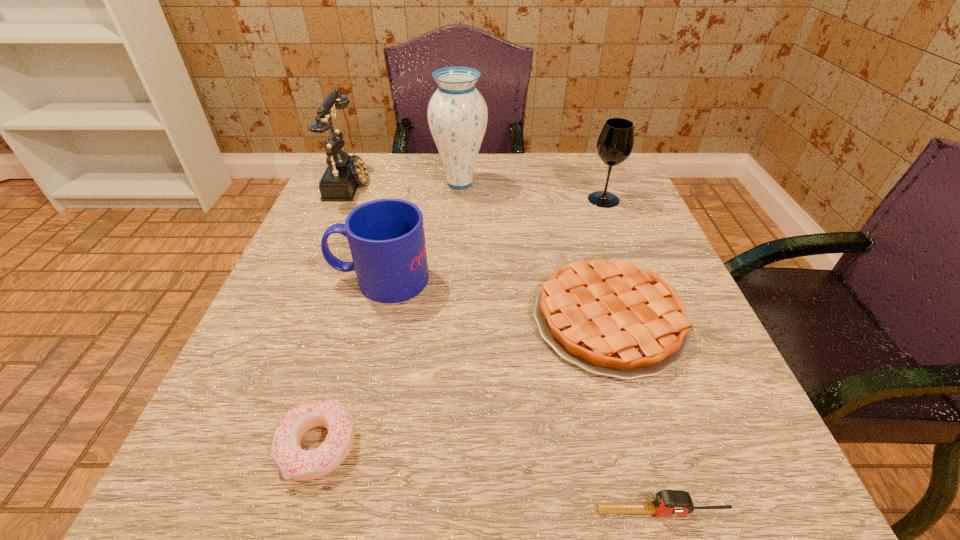
At what (x,y) coordinates should I click in order to perform the action: click on blank space located on the side with the handle of the mug. Please return your answer as a coordinate pair (x, y). Looking at the image, I should click on point(299,279).

Find the location of a particular element. This screenshot has height=540, width=960. free space located 0.400m on the back of the pie is located at coordinates (564, 167).

Find the location of a particular element. The image size is (960, 540). free spot located on the right of the second nearest object is located at coordinates (572, 447).

In order to click on vacant position located 0.060m on the back of the nearest object in this screenshot , I will do `click(647, 454)`.

You are a GUI agent. You are given a task and a screenshot of the screen. Output one action in this format:
    pyautogui.click(x=<x>, y=<y>)
    Task: Click on the vase at the far edge
    
    Given the screenshot: What is the action you would take?
    pyautogui.click(x=457, y=113)

Locate an element on the screen. The image size is (960, 540). telephone that is positioned at the far edge is located at coordinates (344, 173).

Find the location of `wineglass that is at the far edge`. wineglass that is at the far edge is located at coordinates (615, 143).

Identify the location of doughnut that is positioned at the near edge. The width and height of the screenshot is (960, 540). tap(293, 462).

Locate an element on the screen. tape measure that is at the near edge is located at coordinates (669, 503).

Locate an element on the screen. The width and height of the screenshot is (960, 540). telephone that is positioned at the left edge is located at coordinates (344, 173).